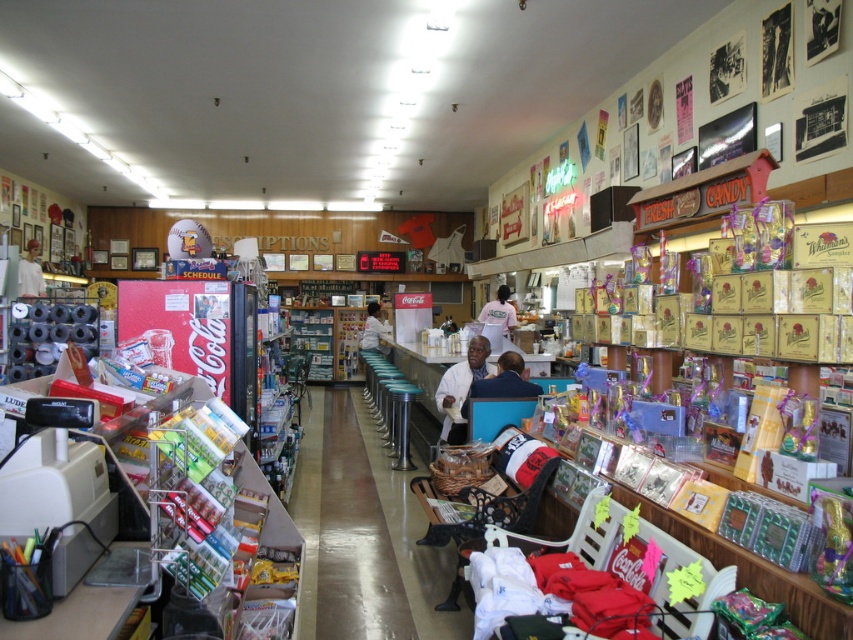
You are a customer in the vintage diner and want to place your drink on the metallic polished counter at center. However, you notice the white cotton shirt at center is already on the counter. Can the drink fit on the counter without spilling over?

The metallic polished counter at center is shorter than the white cotton shirt at center, so the shirt is blocking part of the counter. The drink might spill over if placed near the shirt, but there could still be space elsewhere on the counter.

You are a customer in the vintage convenience store and want to place your bag on the counter. The bag requires a space that is wider than the white matte shirt at center. Can the metallic polished counter at center accommodate your bag?

The metallic polished counter at center has a lesser width compared to white matte shirt at center, so it cannot accommodate the bag which requires a space wider than the white matte shirt at center.

You are a customer in the store and want to pick up the white shirt at center and the white fabric shirt at center. Which one should you grab first if you want to take the one on the left?

The white fabric shirt at center is on the left side of the white shirt at center, so you should grab the white fabric shirt at center first.